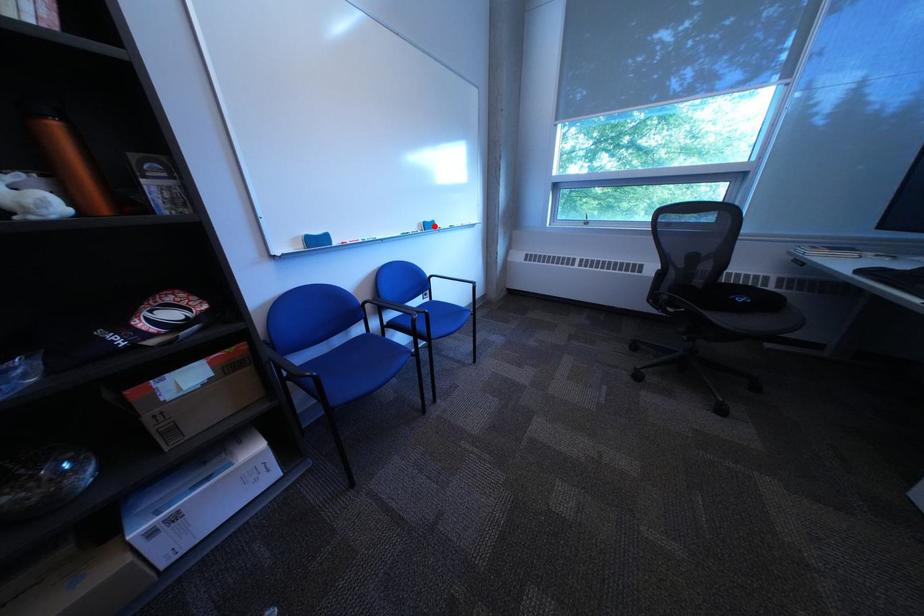
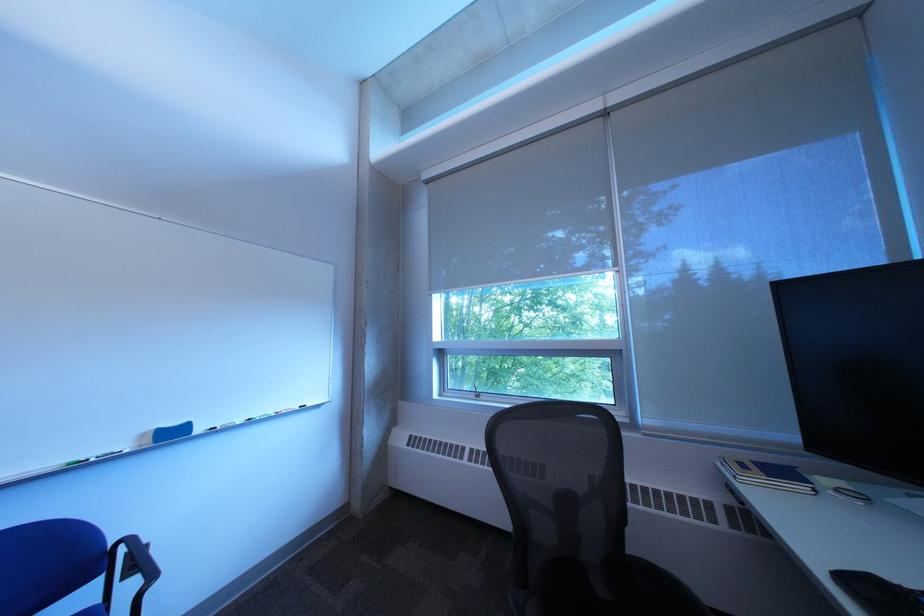
The point at the highlighted location is marked in the first image. Where is the corresponding point in the second image?

(159, 437)